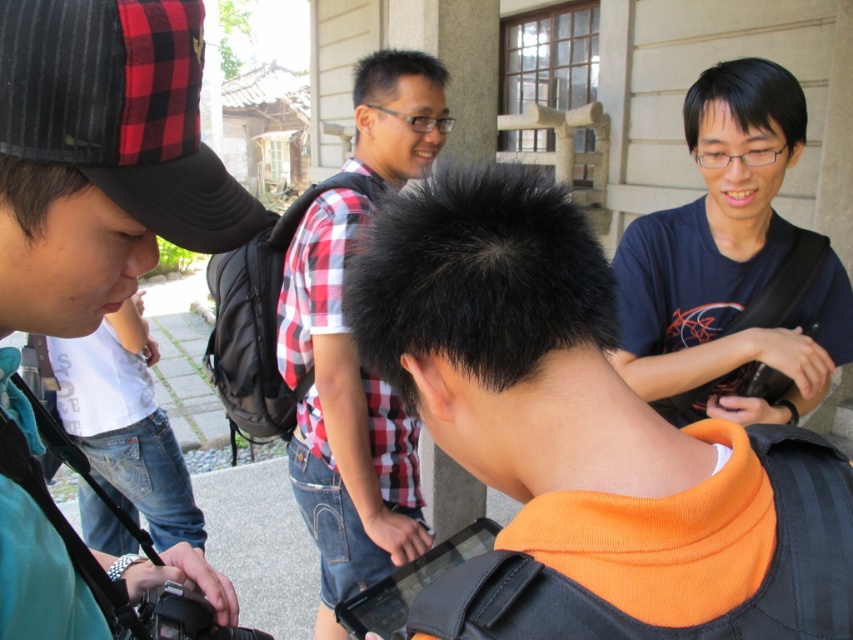
Question: In this image, where is orange fleece at center located relative to dark blue t-shirt at upper right?

Choices:
 (A) above
 (B) below

Answer: (B)

Question: Does green fabric cap at upper left have a lesser width compared to dark blue t-shirt at upper right?

Choices:
 (A) no
 (B) yes

Answer: (B)

Question: Which point appears closest to the camera in this image?

Choices:
 (A) (759, 241)
 (B) (403, 113)
 (C) (55, 81)

Answer: (C)

Question: Which of the following is the farthest from the observer?

Choices:
 (A) checkered fabric shirt at center
 (B) orange fleece at center
 (C) dark blue t-shirt at upper right
 (D) green fabric cap at upper left

Answer: (A)

Question: Which point appears farthest from the camera in this image?

Choices:
 (A) (32, 572)
 (B) (155, 96)

Answer: (A)

Question: Does green fabric cap at upper left have a smaller size compared to checkered fabric shirt at center?

Choices:
 (A) yes
 (B) no

Answer: (A)